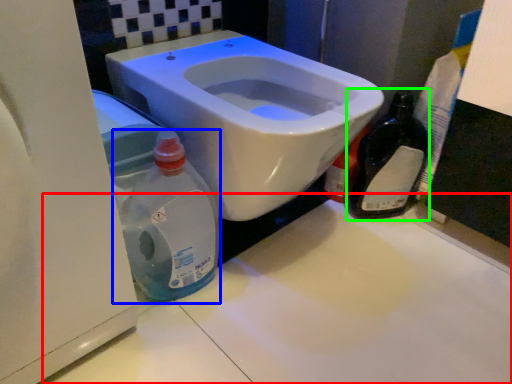
Question: Which object is the closest to the counter top (highlighted by a red box)? Choose among these: cleaning product (highlighted by a blue box) or bottle (highlighted by a green box).

Choices:
 (A) cleaning product
 (B) bottle

Answer: (A)